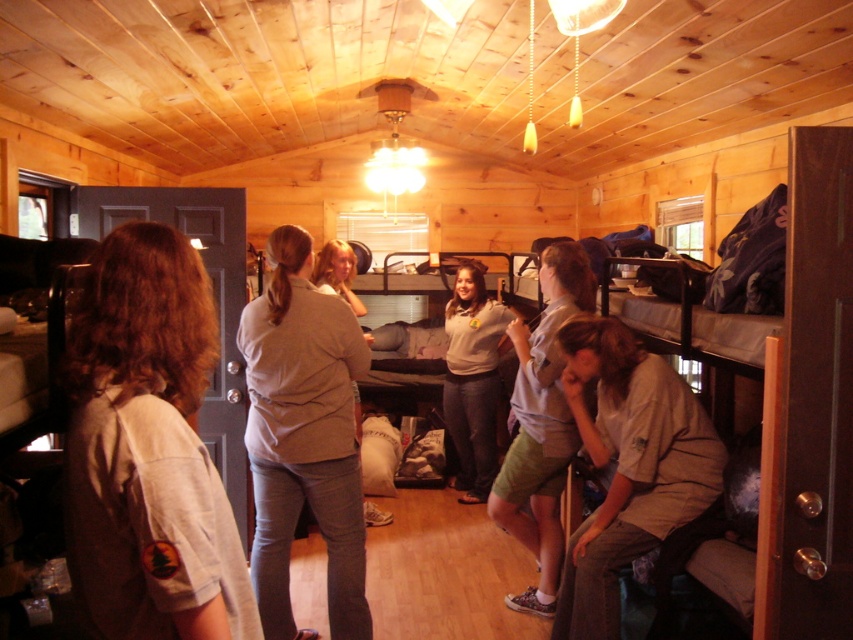
You are standing in the rustic wooden cabin and see two shirts. The tan fabric shirt at center and the gray cotton shirt at lower right. Which shirt is positioned higher in the room?

The tan fabric shirt at center is positioned higher in the room than the gray cotton shirt at lower right.

You are a camp counselor who needs to quickly move from the light brown uniform at left to the tan fabric shirt at center. Can you do so without needing to detour around any obstacles?

The distance between the light brown uniform at left and the tan fabric shirt at center is 4.16 feet, so yes, you can move directly between them without needing to detour around obstacles.